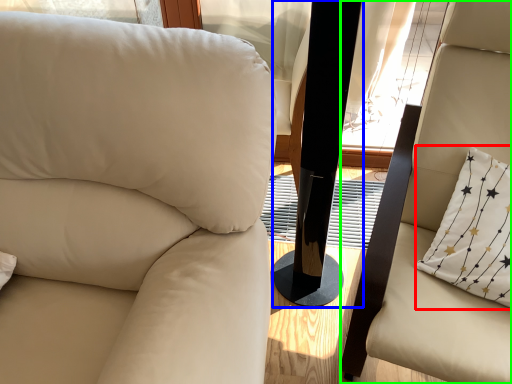
Question: Estimate the real-world distances between objects in this image. Which object is farther from pillow (highlighted by a red box), pillar (highlighted by a blue box) or chair (highlighted by a green box)?

Choices:
 (A) pillar
 (B) chair

Answer: (A)